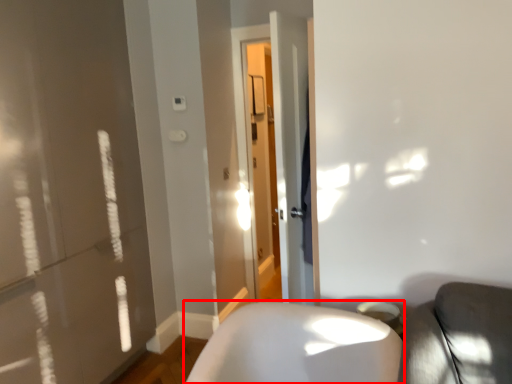
Question: From the image's perspective, what is the correct spatial positioning of furniture (annotated by the red box) in reference to screen door?

Choices:
 (A) above
 (B) below

Answer: (B)